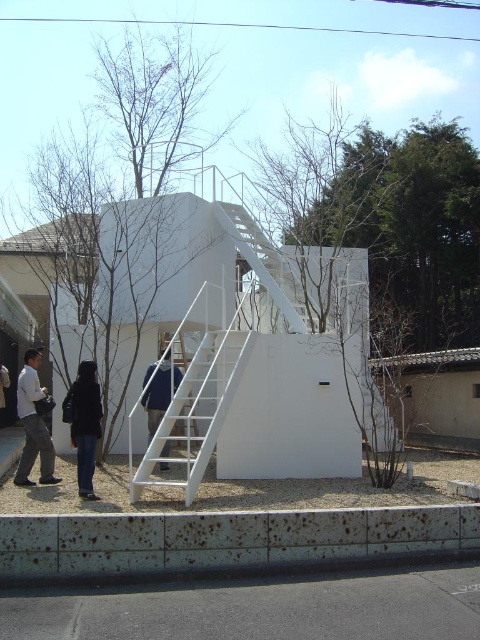
You are standing at the base of the modern architectural structure and want to walk towards the platform at the top. There are two points marked on the gravel area near the staircase. The first point is at coordinates point (28, 419) and the second is at point (73, 381). Which of these points is closer to the staircase entrance?

Point (28, 419) is in front of point (73, 381), so it is closer to the staircase entrance.

You are standing in front of the architectural structure and notice two people walking nearby. Which person is wearing the light brown leather jacket at lower left? Is this person positioned to the left or right of the blue fabric jacket at center?

The light brown leather jacket at lower left is positioned to the left of the blue fabric jacket at center.

You are standing in front of the architectural structure and notice the white matte staircase at center and the blue fabric jacket at center. From your perspective, which object is positioned to the right?

The white matte staircase at center is to the right of the blue fabric jacket at center.